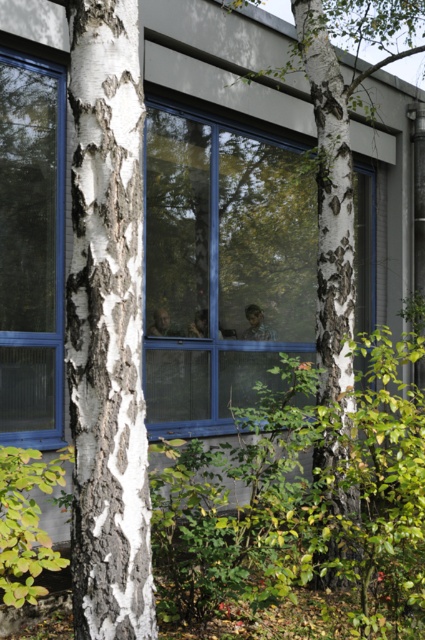
Question: Which object appears closest to the camera in this image?

Choices:
 (A) white textured bark at center
 (B) blue glass window at center
 (C) white bark tree at center

Answer: (A)

Question: Which object is the closest to the white bark tree at center?

Choices:
 (A) white textured bark at center
 (B) transparent glass window at left
 (C) blue glass window at center

Answer: (C)

Question: Is blue glass window at center above transparent glass window at left?

Choices:
 (A) yes
 (B) no

Answer: (B)

Question: Is blue glass window at center below white textured bark at center?

Choices:
 (A) no
 (B) yes

Answer: (A)

Question: Is transparent glass window at left to the left of white bark tree at center from the viewer's perspective?

Choices:
 (A) yes
 (B) no

Answer: (A)

Question: Which point is closer to the camera?

Choices:
 (A) (36, 240)
 (B) (105, 388)
 (C) (206, 237)
 (D) (325, 573)

Answer: (B)